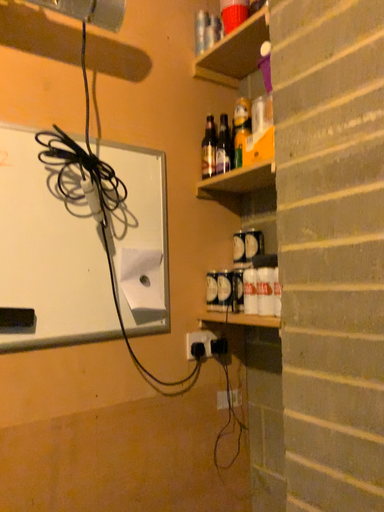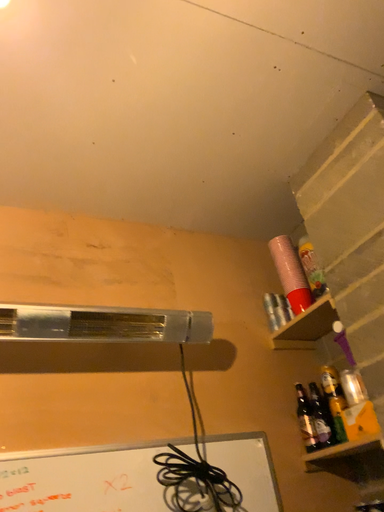
Question: Which way did the camera rotate in the video?

Choices:
 (A) rotated right
 (B) rotated left

Answer: (B)